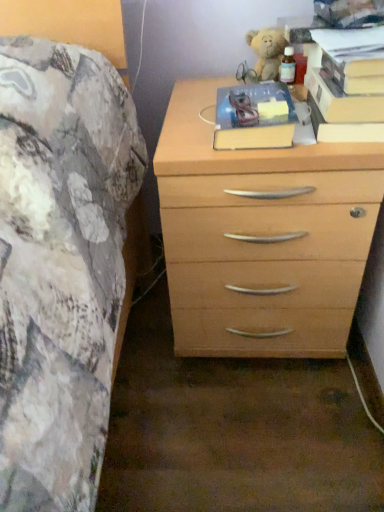
Question: Does hardcover book at center, which appears as the 1th paperback book when viewed from the left, have a larger size compared to hardcover book at upper right, placed as the 2th paperback book when sorted from left to right?

Choices:
 (A) yes
 (B) no

Answer: (B)

Question: Is hardcover book at center, which appears as the 1th paperback book when viewed from the left, to the right of hardcover book at upper right, placed as the 2th paperback book when sorted from left to right, from the viewer's perspective?

Choices:
 (A) no
 (B) yes

Answer: (A)

Question: Is hardcover book at center, which appears as the 1th paperback book when viewed from the left, next to hardcover book at upper right, which ranks as the 2th paperback book in right-to-left order?

Choices:
 (A) no
 (B) yes

Answer: (A)

Question: Considering the relative sizes of hardcover book at center, the 3th paperback book viewed from the right, and hardcover book at upper right, placed as the 2th paperback book when sorted from left to right, in the image provided, is hardcover book at center, the 3th paperback book viewed from the right, smaller than hardcover book at upper right, placed as the 2th paperback book when sorted from left to right,?

Choices:
 (A) yes
 (B) no

Answer: (A)

Question: From the image's perspective, is hardcover book at center, the 3th paperback book viewed from the right, located above hardcover book at upper right, which ranks as the 2th paperback book in right-to-left order?

Choices:
 (A) no
 (B) yes

Answer: (A)

Question: From the image's perspective, is hardcover book at upper right, which ranks as the 2th paperback book in right-to-left order, positioned above or below hardcover book at upper right, marked as the first paperback book in a right-to-left arrangement?

Choices:
 (A) below
 (B) above

Answer: (A)

Question: In terms of size, does hardcover book at upper right, which ranks as the 2th paperback book in right-to-left order, appear bigger or smaller than hardcover book at upper right, placed as the third paperback book when sorted from left to right?

Choices:
 (A) small
 (B) big

Answer: (B)

Question: Considering their positions, is hardcover book at upper right, placed as the 2th paperback book when sorted from left to right, located in front of or behind hardcover book at upper right, marked as the first paperback book in a right-to-left arrangement?

Choices:
 (A) front
 (B) behind

Answer: (B)

Question: Is point (362, 104) positioned closer to the camera than point (350, 54)?

Choices:
 (A) farther
 (B) closer

Answer: (A)

Question: In terms of width, does hardcover book at center, the 3th paperback book viewed from the right, look wider or thinner when compared to fluffy beige teddy bear at upper right?

Choices:
 (A) wide
 (B) thin

Answer: (A)

Question: From the image's perspective, is hardcover book at center, which appears as the 1th paperback book when viewed from the left, above or below fluffy beige teddy bear at upper right?

Choices:
 (A) above
 (B) below

Answer: (B)

Question: In terms of size, does hardcover book at center, which appears as the 1th paperback book when viewed from the left, appear bigger or smaller than fluffy beige teddy bear at upper right?

Choices:
 (A) big
 (B) small

Answer: (A)

Question: Is point (276, 106) positioned closer to the camera than point (266, 57)?

Choices:
 (A) farther
 (B) closer

Answer: (B)

Question: From a real-world perspective, is hardcover book at center, which appears as the 1th paperback book when viewed from the left, above or below hardcover book at upper right, placed as the third paperback book when sorted from left to right?

Choices:
 (A) above
 (B) below

Answer: (B)

Question: Is hardcover book at center, the 3th paperback book viewed from the right, wider or thinner than hardcover book at upper right, placed as the third paperback book when sorted from left to right?

Choices:
 (A) thin
 (B) wide

Answer: (A)